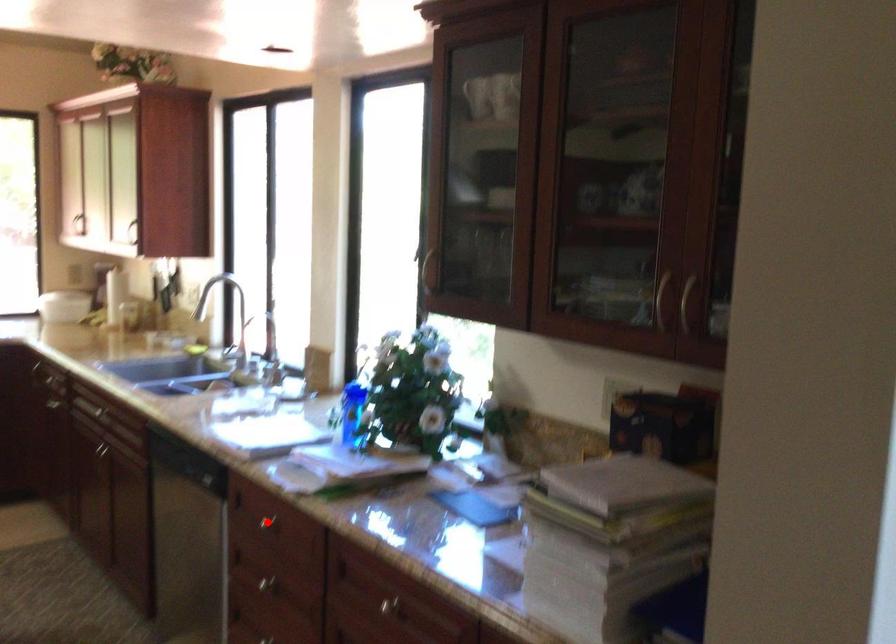
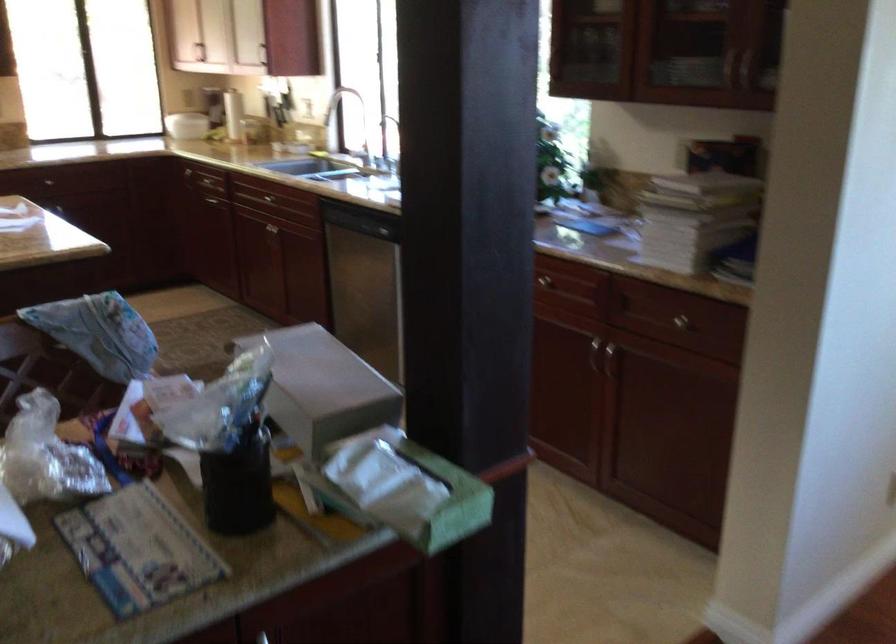
Question: I am providing you with two images of the same scene from different viewpoints. A red point is marked on the first image. Can you still see the location of the red point in image 2?

Choices:
 (A) Yes
 (B) No

Answer: (B)